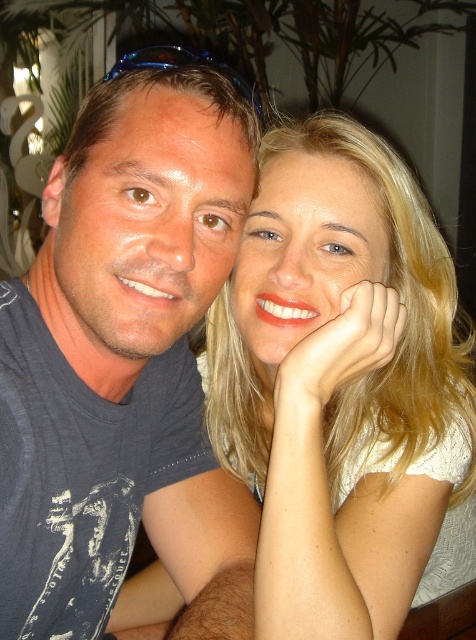
You are a photographer trying to adjust the lighting for a photo shoot. You notice a point at coordinates (x=125, y=364) in the image. Based on the scene description, what object is located at this point?

The point at coordinates (x=125, y=364) corresponds to the dark blue tshirt at left.